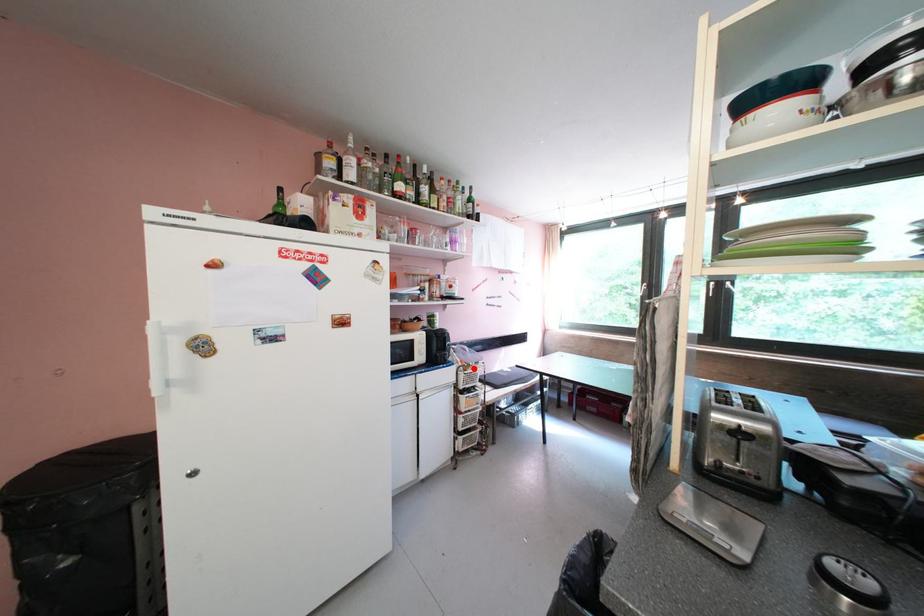
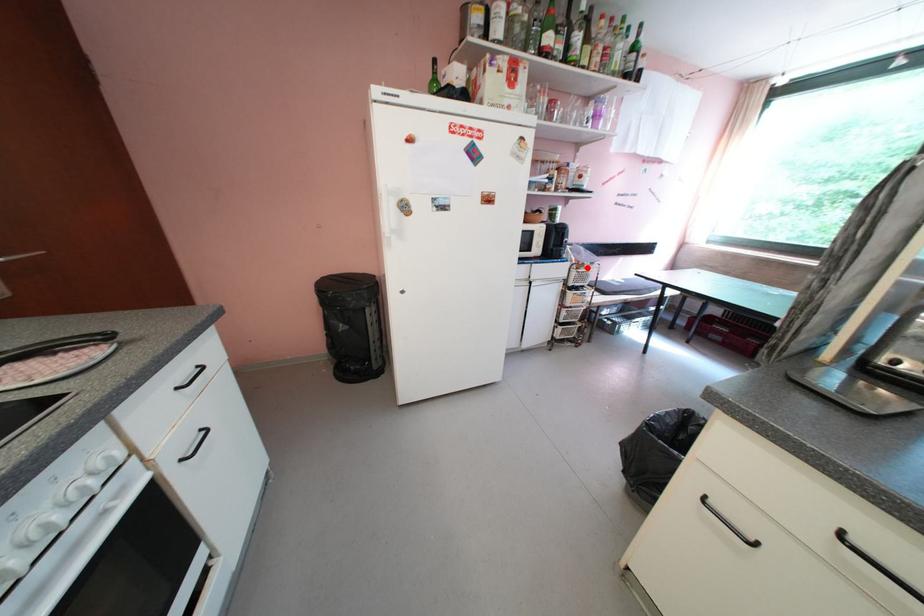
I am providing you with two images of the same scene from different viewpoints. A red point is marked on the first image and another point is marked on the second image. Are the points marked in image1 and image2 representing the same 3D position?

Yes